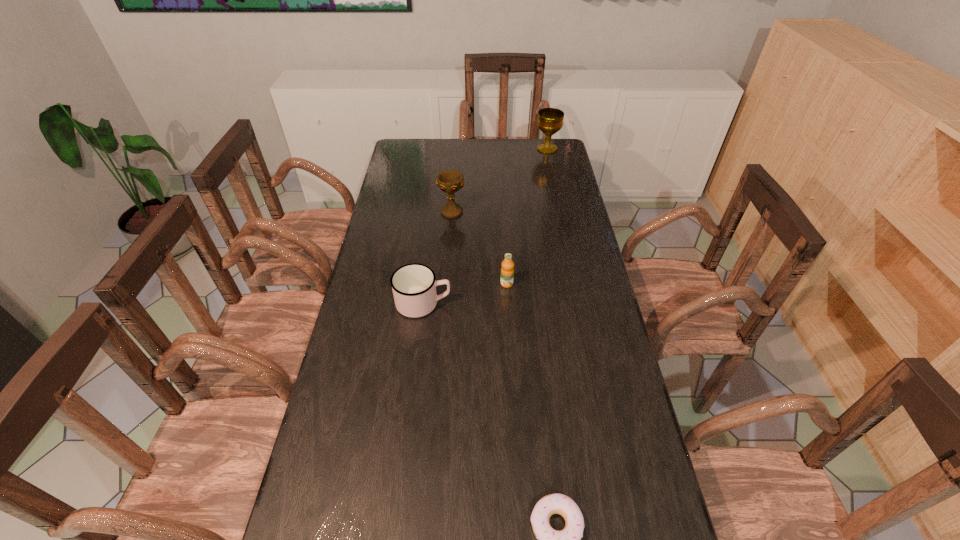
At what (x,y) coordinates should I click in order to perform the action: click on blank region between the left chalice and the orange juice. Please return your answer as a coordinate pair (x, y). Looking at the image, I should click on (479, 248).

This screenshot has width=960, height=540. In order to click on empty space between the left chalice and the mug in this screenshot , I will do `click(438, 258)`.

This screenshot has width=960, height=540. I want to click on free space between the orange juice and the mug, so click(x=465, y=293).

Find the location of a particular element. vacant space that is in between the orange juice and the farther chalice is located at coordinates (527, 217).

Where is `vacant area that lies between the rightmost object and the orange juice`? The image size is (960, 540). vacant area that lies between the rightmost object and the orange juice is located at coordinates (527, 217).

Identify the location of free space between the mug and the left chalice. (438, 258).

What are the coordinates of `the third closest object relative to the mug` in the screenshot? It's located at (548, 539).

Where is `the third closest object relative to the nearer chalice`? the third closest object relative to the nearer chalice is located at coordinates (550, 120).

Locate an element on the screen. Image resolution: width=960 pixels, height=540 pixels. vacant space that satisfies the following two spatial constraints: 1. on the front side of the nearer chalice; 2. on the side of the mug with the handle is located at coordinates (444, 303).